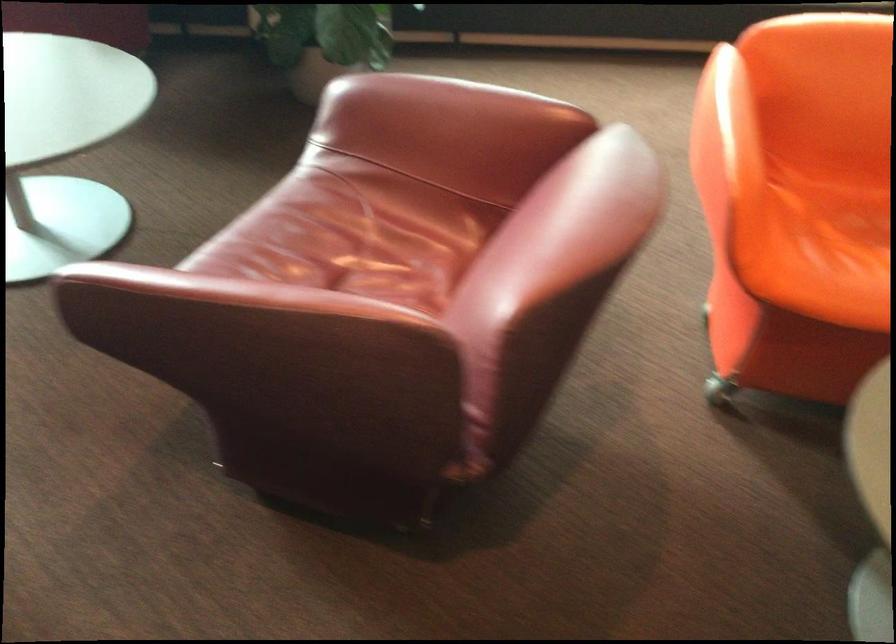
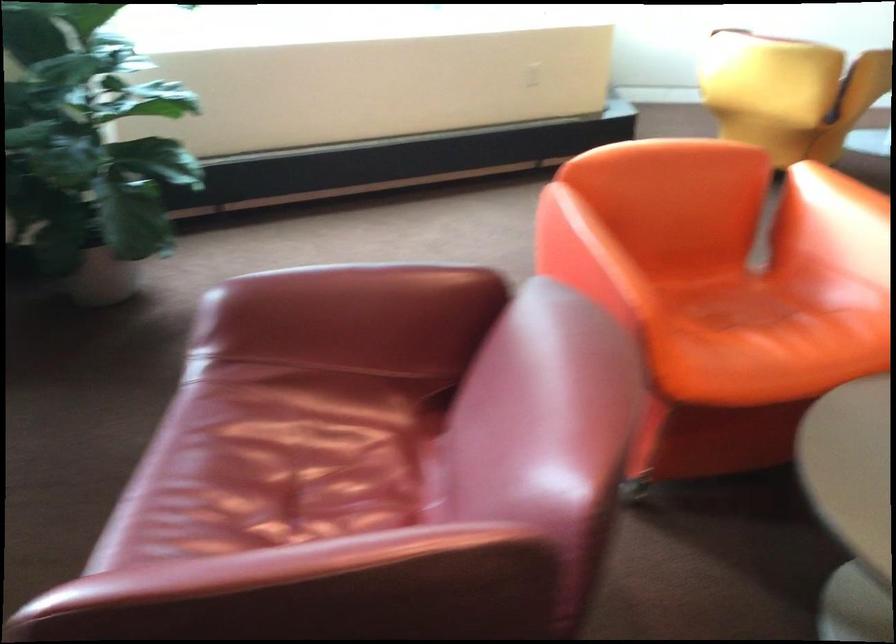
Question: The camera is either moving clockwise (left) or counter-clockwise (right) around the object. The first image is from the beginning of the video and the second image is from the end. Is the camera moving left or right when shooting the video?

Choices:
 (A) Left
 (B) Right

Answer: (A)